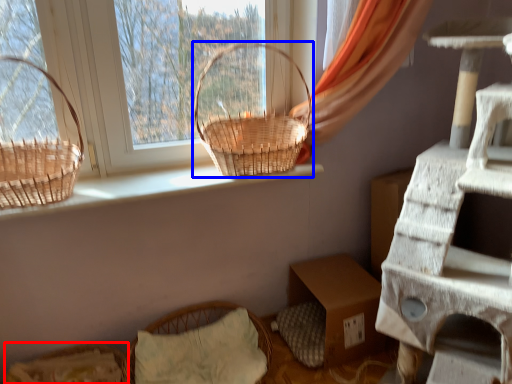
Question: Among these objects, which one is farthest to the camera, flower basket (highlighted by a red box) or picnic basket (highlighted by a blue box)?

Choices:
 (A) flower basket
 (B) picnic basket

Answer: (B)